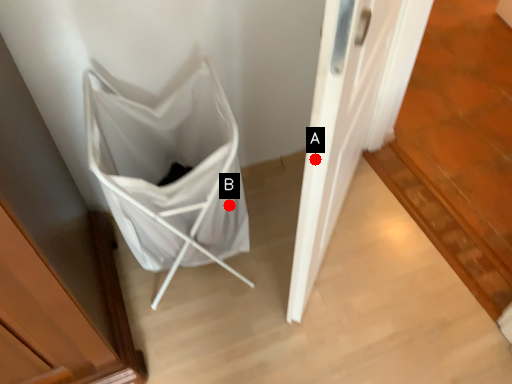
Question: Two points are circled on the image, labeled by A and B beside each circle. Which of the following is the farthest from the observer?

Choices:
 (A) A is further
 (B) B is further

Answer: (B)